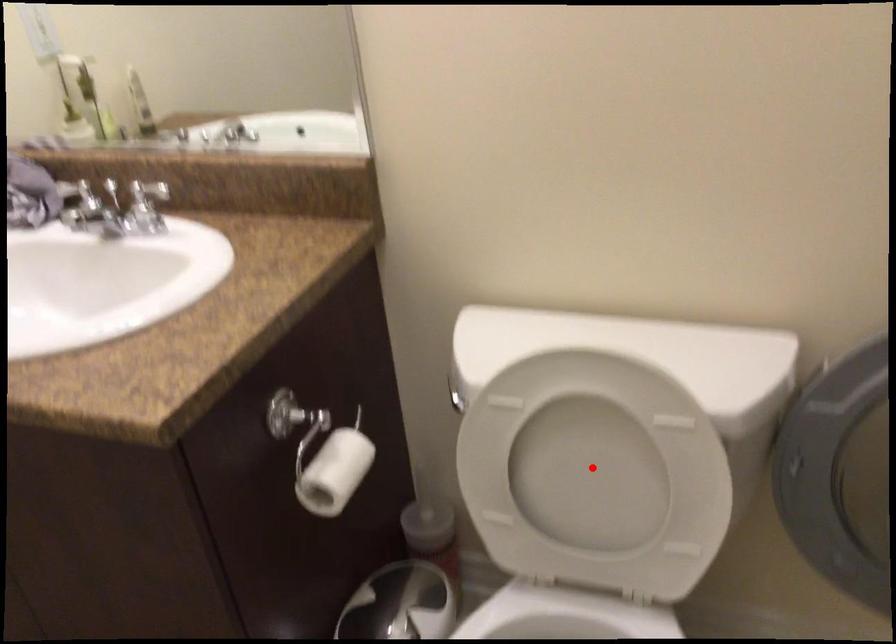
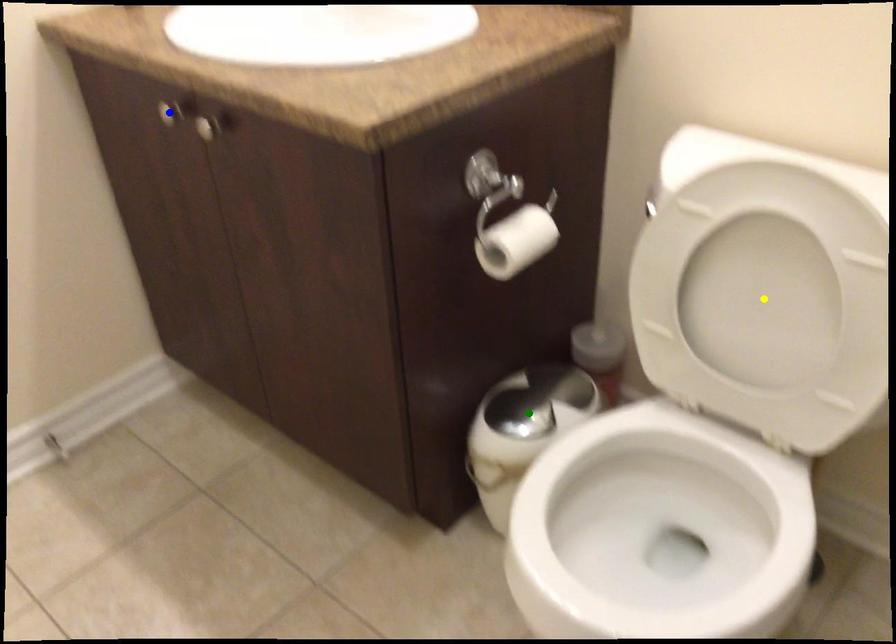
Question: I am providing you with two images of the same scene from different viewpoints. A red point is marked on the first image. You are given multiple points on the second image. Which point in image 2 represents the same 3d spot as the red point in image 1?

Choices:
 (A) yellow point
 (B) green point
 (C) blue point

Answer: (A)